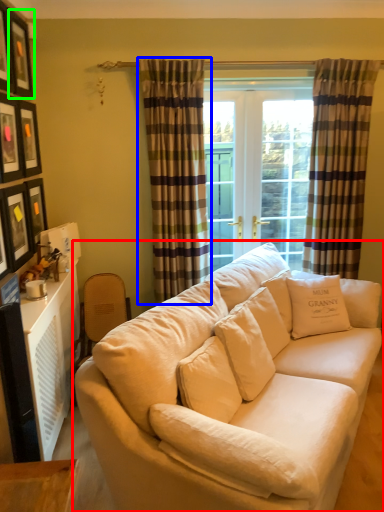
Question: Which object is positioned farthest from studio couch (highlighted by a red box)? Select from curtain (highlighted by a blue box) and picture frame (highlighted by a green box).

Choices:
 (A) curtain
 (B) picture frame

Answer: (B)